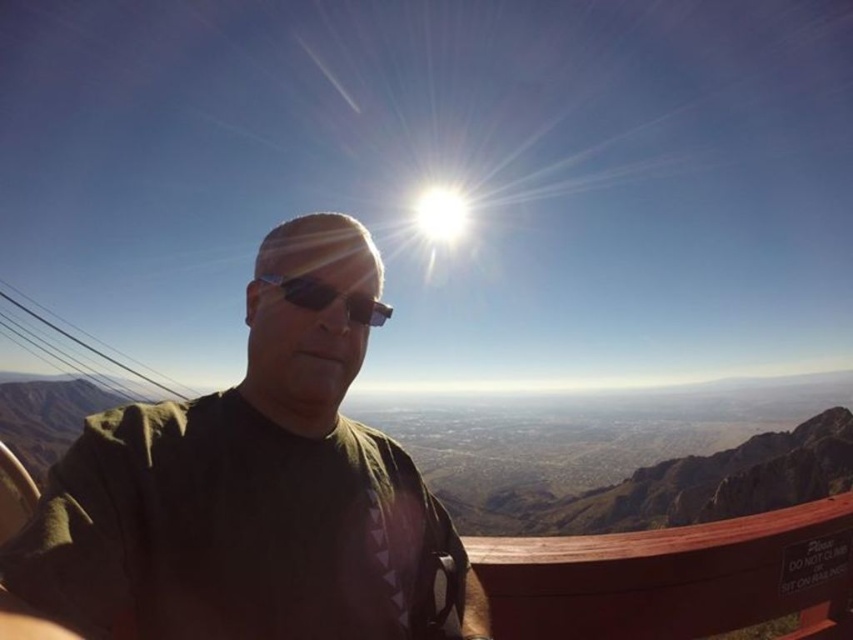
Describe the element at coordinates (247, 488) in the screenshot. I see `dark green t-shirt at center` at that location.

Which of these two, dark green t-shirt at center or sunglasses at center, stands shorter?

With less height is sunglasses at center.

I want to click on dark green t-shirt at center, so click(x=247, y=488).

Find the location of `dark green t-shirt at center`. dark green t-shirt at center is located at coordinates click(x=247, y=488).